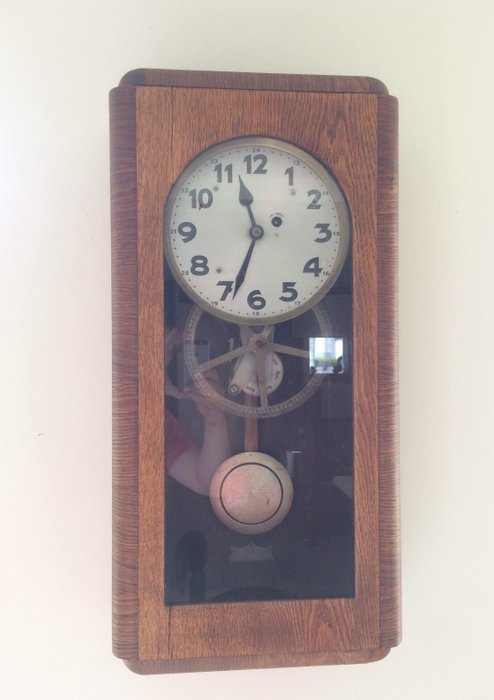
Locate an element on the screen. This screenshot has height=700, width=494. wooden clock frame is located at coordinates (143, 281).